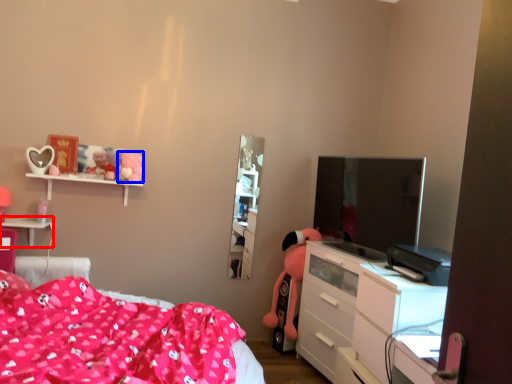
Question: Which object appears closest to the camera in this image, table (highlighted by a red box) or toy (highlighted by a blue box)?

Choices:
 (A) table
 (B) toy

Answer: (A)